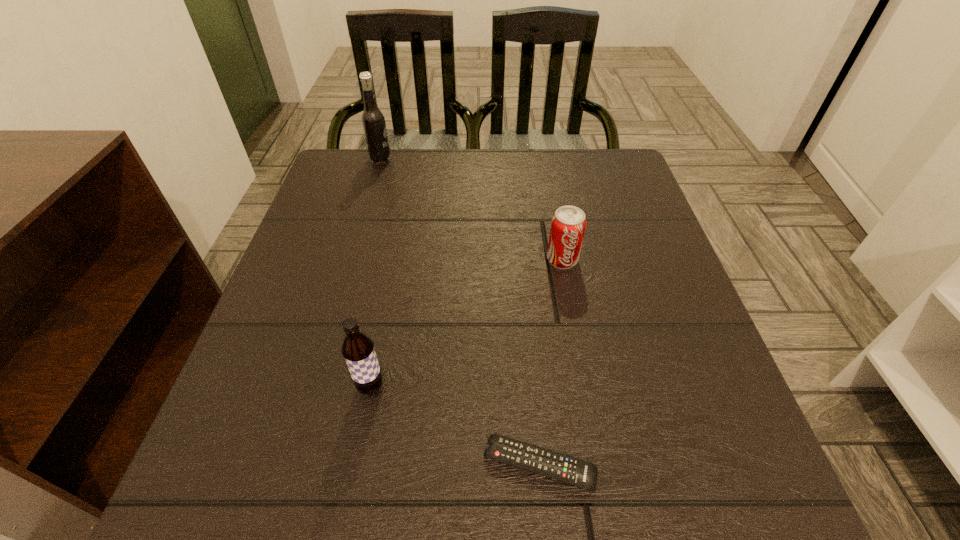
Identify the location of vacant point at the near left corner. Image resolution: width=960 pixels, height=540 pixels. (292, 458).

Where is `empty space between the shortest object and the shorter root beer`? empty space between the shortest object and the shorter root beer is located at coordinates (455, 426).

Find the location of `free spot between the remote control and the tallest object`. free spot between the remote control and the tallest object is located at coordinates (460, 312).

Image resolution: width=960 pixels, height=540 pixels. In order to click on vacant point located between the second nearest object and the third nearest object in this screenshot , I will do `click(467, 323)`.

Find the location of a particular element. Image resolution: width=960 pixels, height=540 pixels. free spot between the tallest object and the nearer root beer is located at coordinates (375, 273).

At what (x,y) coordinates should I click in order to perform the action: click on vacant area that lies between the second tallest object and the left root beer. Please return your answer as a coordinate pair (x, y). Looking at the image, I should click on (375, 273).

Identify the location of free space between the nearer root beer and the third nearest object. This screenshot has height=540, width=960. (467, 323).

You are a GUI agent. You are given a task and a screenshot of the screen. Output one action in this format:
    pyautogui.click(x=<x>, y=<y>)
    Task: Click on the vacant area that lies between the nearest object and the left root beer
    The image size is (960, 540).
    Given the screenshot: What is the action you would take?
    pyautogui.click(x=460, y=312)

This screenshot has width=960, height=540. What are the coordinates of `free space between the third object from right to left and the second shortest object` in the screenshot? It's located at (467, 323).

Identify the location of free spot between the right root beer and the third nearest object. The height and width of the screenshot is (540, 960). (467, 323).